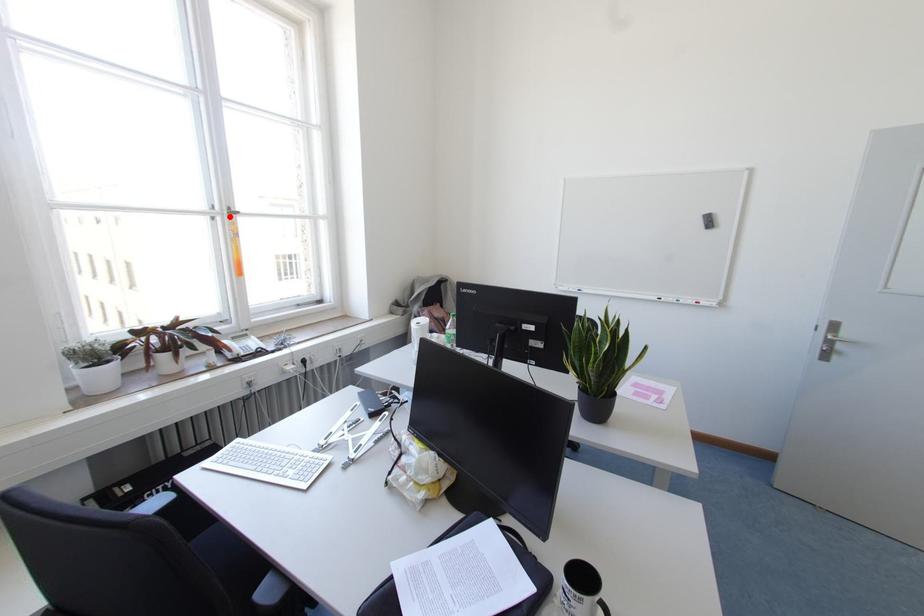
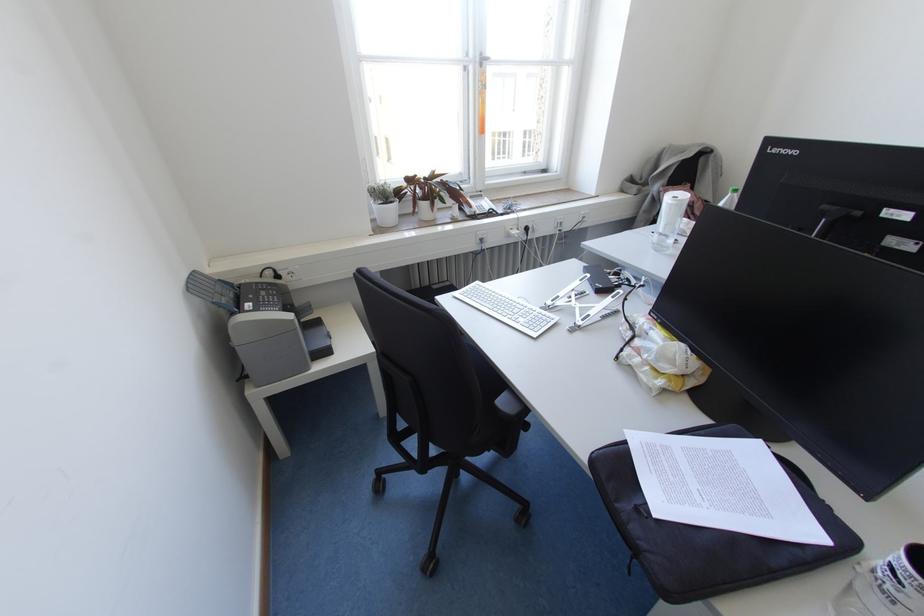
In the second image, find the point that corresponds to the highlighted location in the first image.

(480, 65)